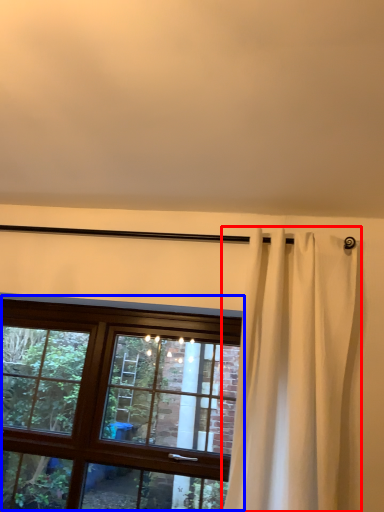
Question: Which object appears farthest to the camera in this image, curtain (highlighted by a red box) or window (highlighted by a blue box)?

Choices:
 (A) curtain
 (B) window

Answer: (B)